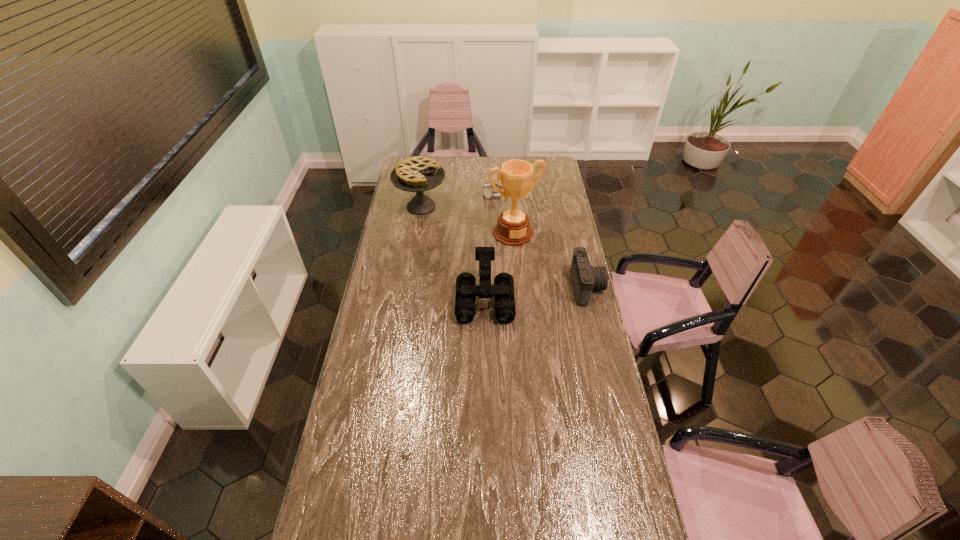
I want to click on the third tallest object, so click(466, 289).

What are the coordinates of `the rightmost object` in the screenshot? It's located at (585, 278).

Locate an element on the screen. This screenshot has height=540, width=960. the second shortest object is located at coordinates (585, 278).

The height and width of the screenshot is (540, 960). Identify the location of watch. (487, 191).

Image resolution: width=960 pixels, height=540 pixels. I want to click on the leftmost object, so (x=417, y=174).

In order to click on the fourth shortest object in this screenshot , I will do `click(417, 174)`.

In order to click on award in this screenshot , I will do `click(513, 229)`.

Locate an element on the screen. vacant space situated 0.090m on the front lenses of the binoculars is located at coordinates (486, 343).

Where is `vacant space situated 0.080m on the face of the watch`? The height and width of the screenshot is (540, 960). vacant space situated 0.080m on the face of the watch is located at coordinates (498, 209).

The height and width of the screenshot is (540, 960). Find the location of `vacant space located on the face of the watch`. vacant space located on the face of the watch is located at coordinates (498, 208).